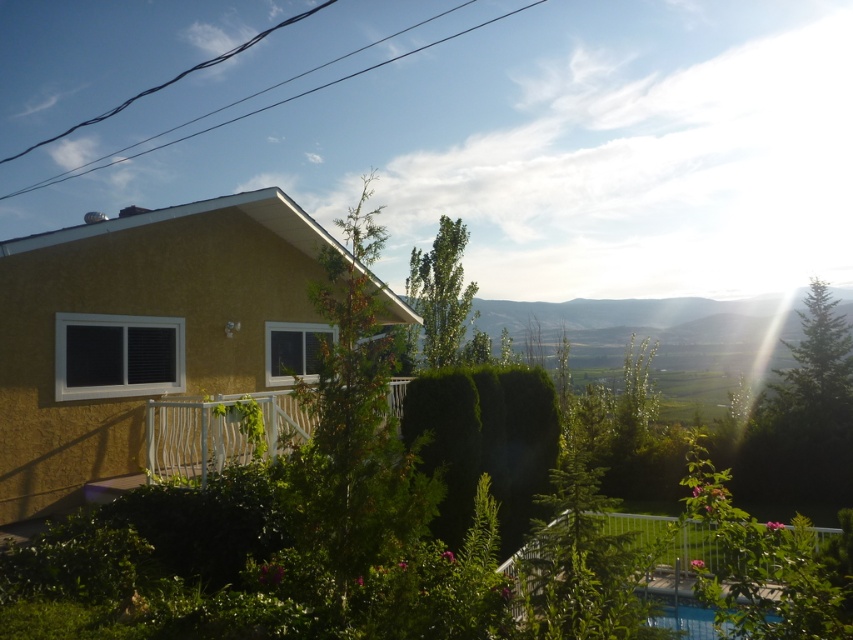
Which is below, black wire at upper center or transparent glass pool at lower right?

transparent glass pool at lower right

The width and height of the screenshot is (853, 640). What do you see at coordinates (258, 108) in the screenshot?
I see `black wire at upper center` at bounding box center [258, 108].

Which is in front, point (74, 168) or point (651, 602)?

Point (651, 602) is more forward.

Locate an element on the screen. The width and height of the screenshot is (853, 640). black wire at upper center is located at coordinates (258, 108).